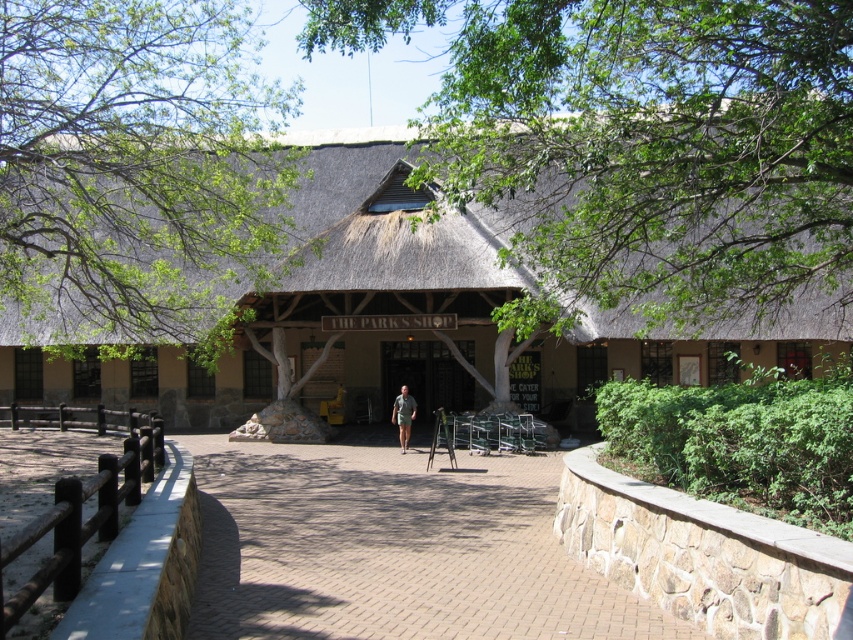
You are standing at the entrance of THE PARK SHOP and want to reach the point marked as point (358,566). There is an obstacle at point (672,90). Which direction should you move to avoid the obstacle?

Since point (672,90) is behind point (358,566), you can safely move towards point (358,566) without encountering the obstacle at point (672,90) as it is located behind your target point.